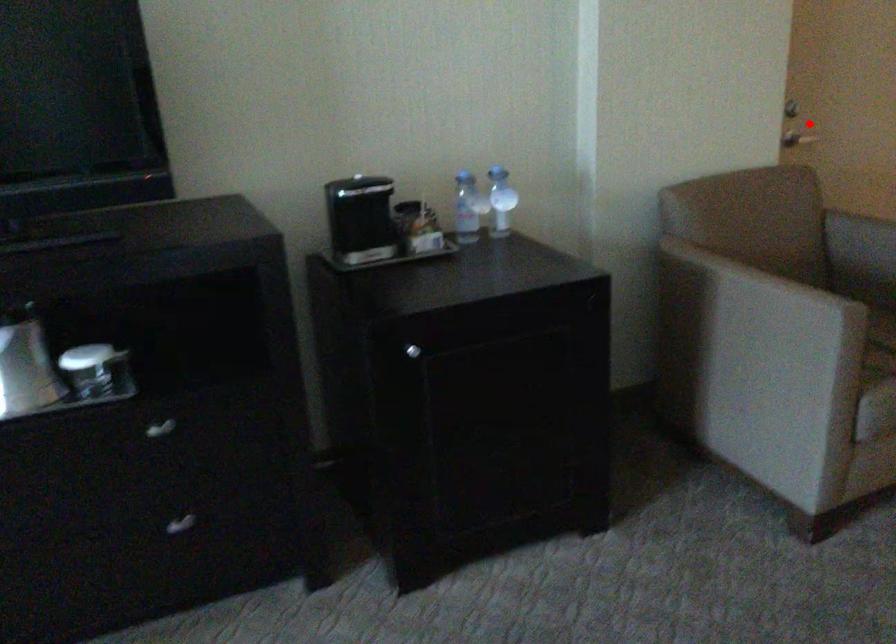
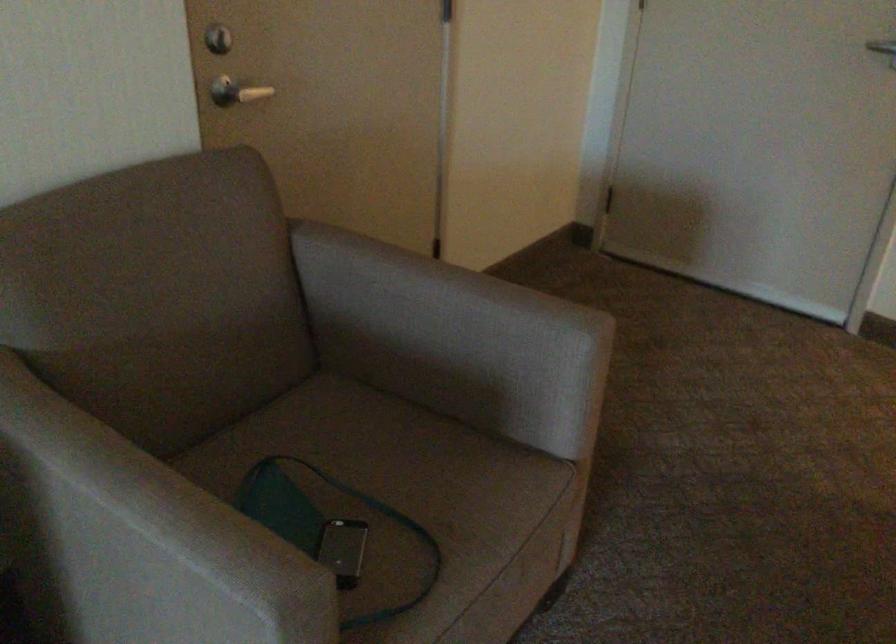
Question: I am providing you with two images of the same scene from different viewpoints. Given a red point in image1, look at the same physical point in image2. Is it:

Choices:
 (A) Closer to the viewpoint
 (B) Farther from the viewpoint

Answer: (A)